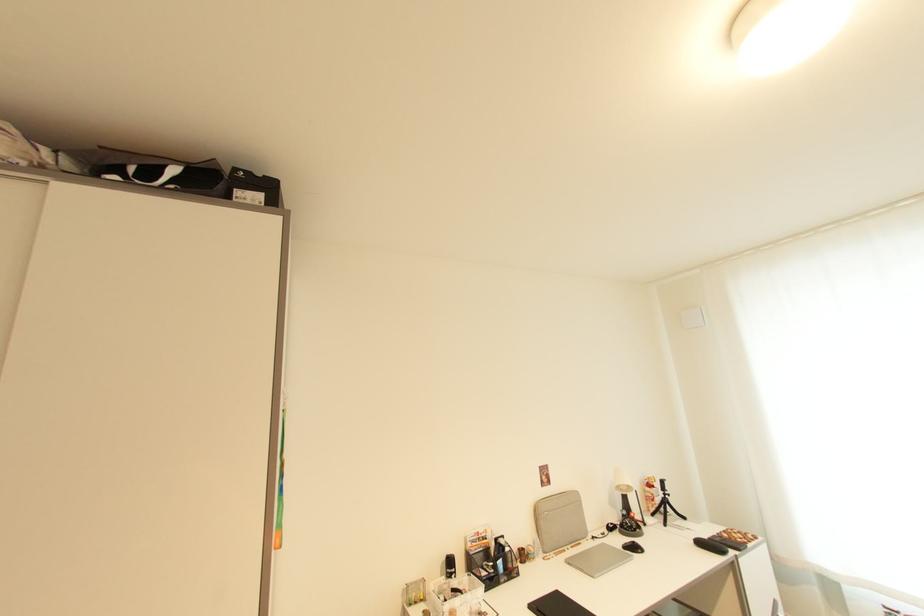
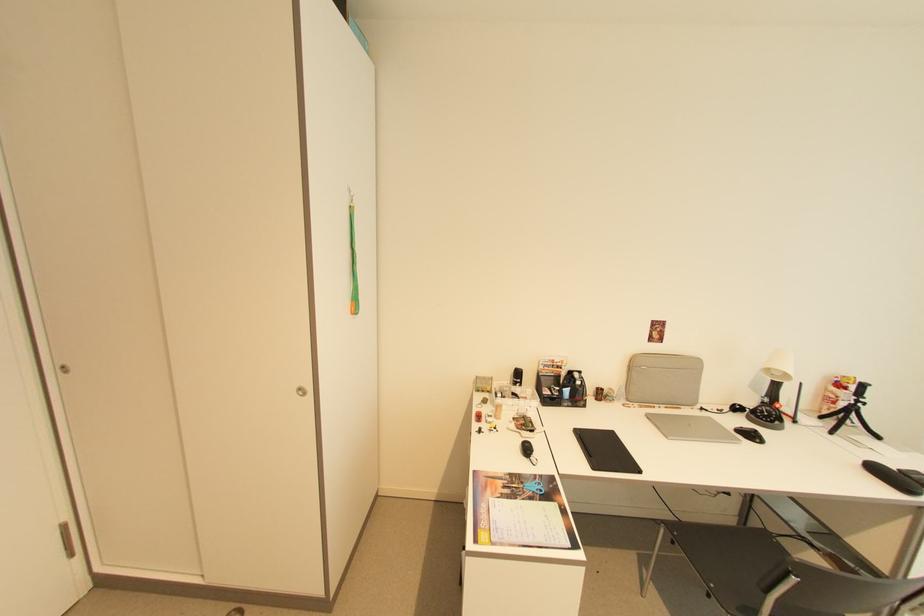
Question: I am providing you with two images of the same scene from different viewpoints. Which of the following objects are not visible in image2?

Choices:
 (A) black computer mouse
 (B) closed silver laptop
 (C) black tripod
 (D) none of these

Answer: (D)